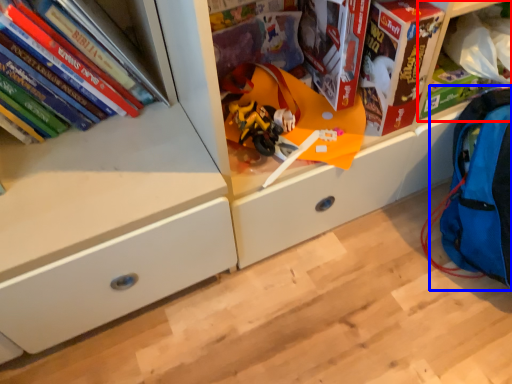
Question: Which object is closer to the camera taking this photo, shelf (highlighted by a red box) or backpack (highlighted by a blue box)?

Choices:
 (A) shelf
 (B) backpack

Answer: (B)